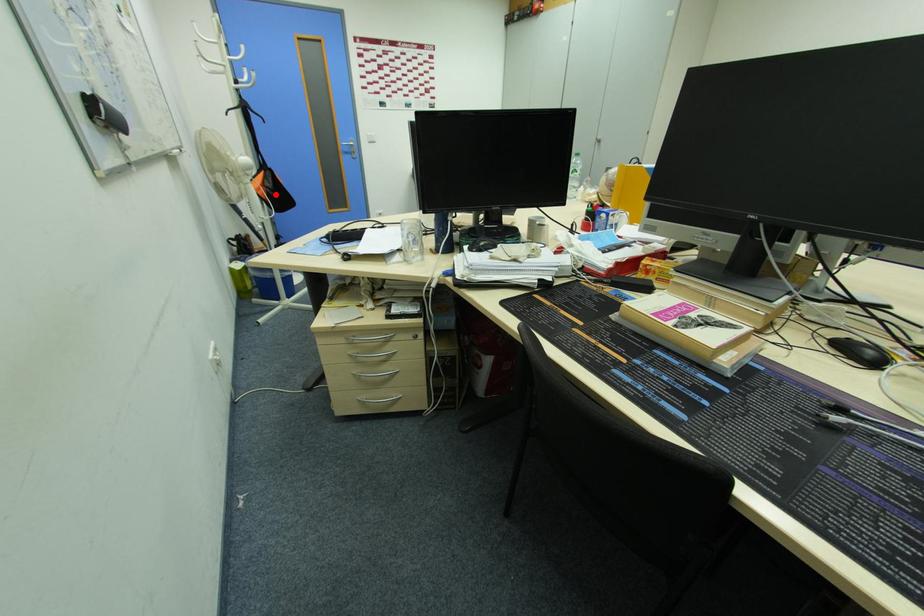
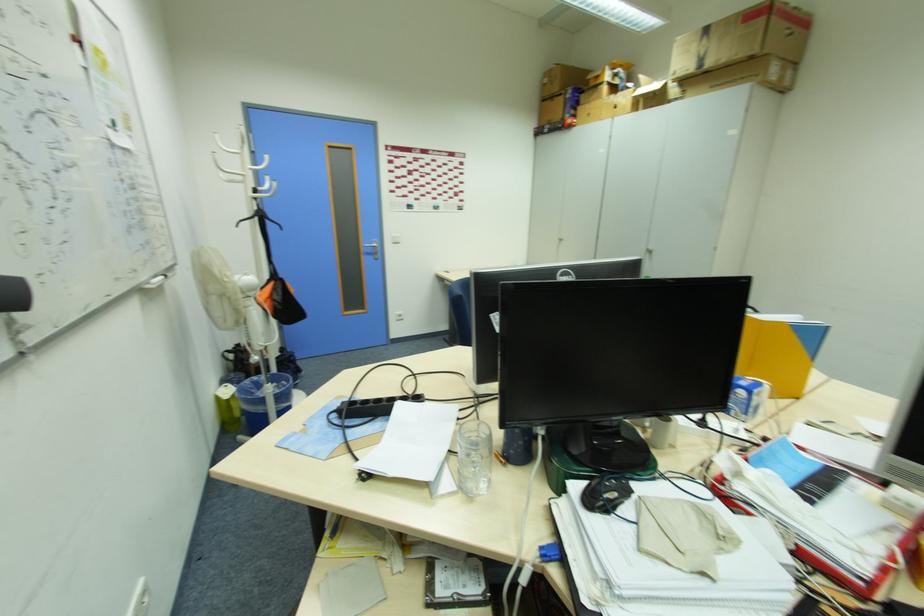
Question: I am providing you with two images of the same scene from different viewpoints. Image1 has a red point marked. In image2, the corresponding 3D location appears at what relative position? Reply with the corresponding letter.

Choices:
 (A) Closer
 (B) Farther

Answer: (B)